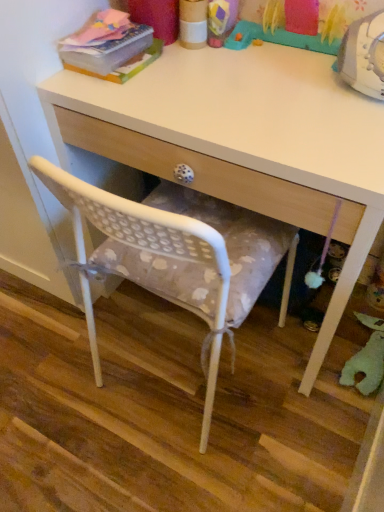
This screenshot has width=384, height=512. I want to click on free space that is to the left of plastic toy at upper center, the first toy viewed from the top, so click(x=203, y=71).